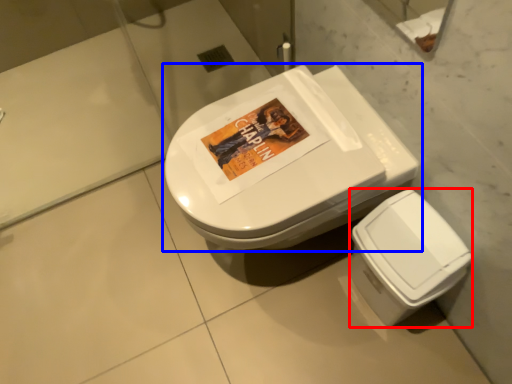
Question: Which point is further to the camera, bidet (highlighted by a red box) or toilet (highlighted by a blue box)?

Choices:
 (A) bidet
 (B) toilet

Answer: (A)